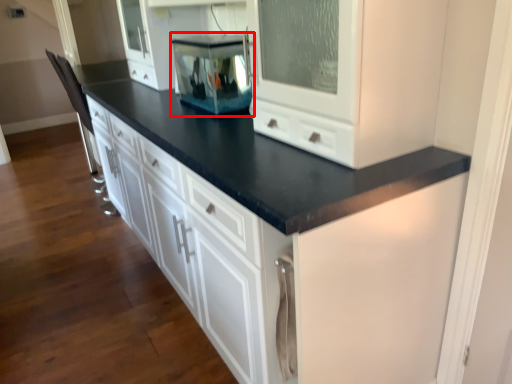
Question: Where is appliance (annotated by the red box) located in relation to cabinetry in the image?

Choices:
 (A) right
 (B) left

Answer: (A)